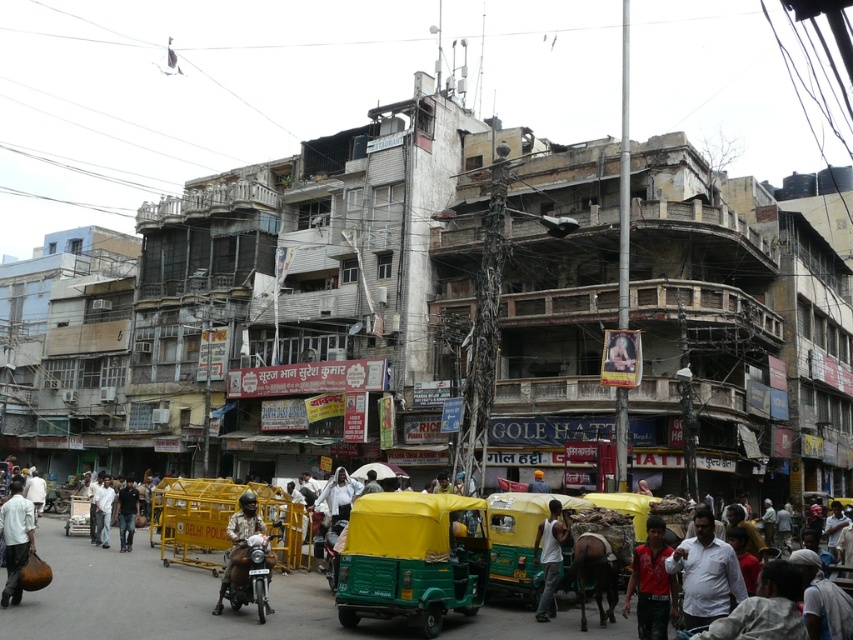
You are standing on the bustling urban street scene in India and want to take a photo. There are two points marked in the image at coordinates point (326,532) and point (70,509). Which point should you focus on to ensure it appears larger in your photo?

Point (326,532) should be focused on because it is closer to the camera and will appear larger in the photo compared to point (70,509) which is further away.

You are a delivery person needing to navigate through the street. You see a metallic green motorcycle at center and a wooden cart at center. Which one is positioned higher from the ground?

The metallic green motorcycle at center is located above the wooden cart at center, so it is positioned higher from the ground.